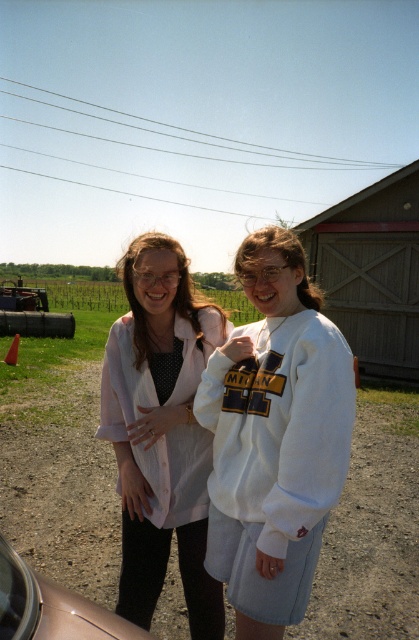
Question: Considering the real-world distances, which object is closest to the dirt track at lower center?

Choices:
 (A) pink fabric shirt at upper left
 (B) white fleece sweatshirt at center

Answer: (A)

Question: Estimate the real-world distances between objects in this image. Which object is closer to the pink fabric shirt at upper left?

Choices:
 (A) white fleece sweatshirt at center
 (B) metallic silver car at lower left

Answer: (A)

Question: Does dirt track at lower center have a greater width compared to white fleece sweatshirt at center?

Choices:
 (A) yes
 (B) no

Answer: (A)

Question: Which object appears farthest from the camera in this image?

Choices:
 (A) pink fabric shirt at upper left
 (B) white fleece sweatshirt at center

Answer: (A)

Question: Does dirt track at lower center appear on the left side of metallic silver car at lower left?

Choices:
 (A) no
 (B) yes

Answer: (B)

Question: Is white fleece sweatshirt at center thinner than pink fabric shirt at upper left?

Choices:
 (A) no
 (B) yes

Answer: (B)